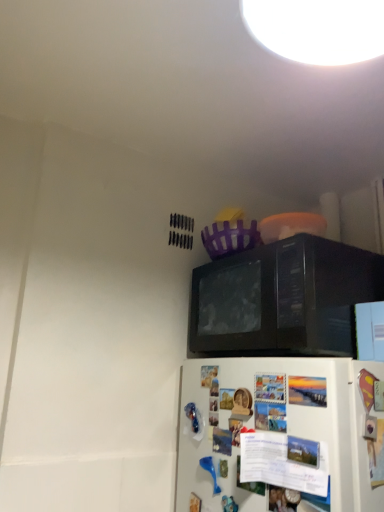
At what (x,y) coordinates should I click in order to perform the action: click on black matte microwave at upper right. Please return your answer as a coordinate pair (x, y). Looking at the image, I should click on (283, 298).

This screenshot has width=384, height=512. What do you see at coordinates (283, 298) in the screenshot?
I see `black matte microwave at upper right` at bounding box center [283, 298].

I want to click on black matte microwave at upper right, so click(x=283, y=298).